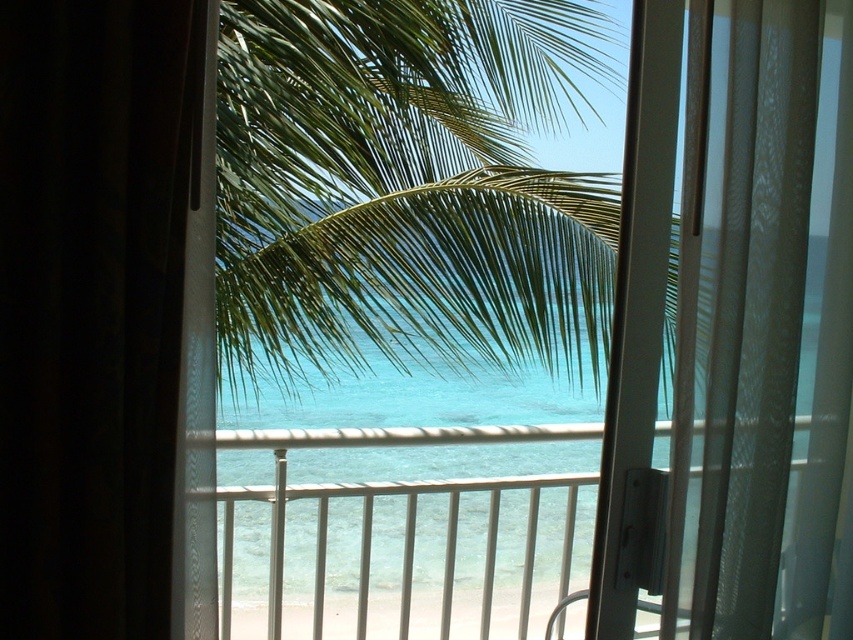
Question: Which object appears closest to the camera in this image?

Choices:
 (A) green leafy palm tree at center
 (B) black sheer curtain at left

Answer: (B)

Question: Which point is farther to the camera?

Choices:
 (A) [x=138, y=433]
 (B) [x=440, y=17]

Answer: (B)

Question: Is green leafy palm tree at center above black sheer curtain at left?

Choices:
 (A) no
 (B) yes

Answer: (B)

Question: Considering the relative positions of green leafy palm tree at center and black sheer curtain at left in the image provided, where is green leafy palm tree at center located with respect to black sheer curtain at left?

Choices:
 (A) below
 (B) above

Answer: (B)

Question: Is green leafy palm tree at center positioned at the back of black sheer curtain at left?

Choices:
 (A) no
 (B) yes

Answer: (B)